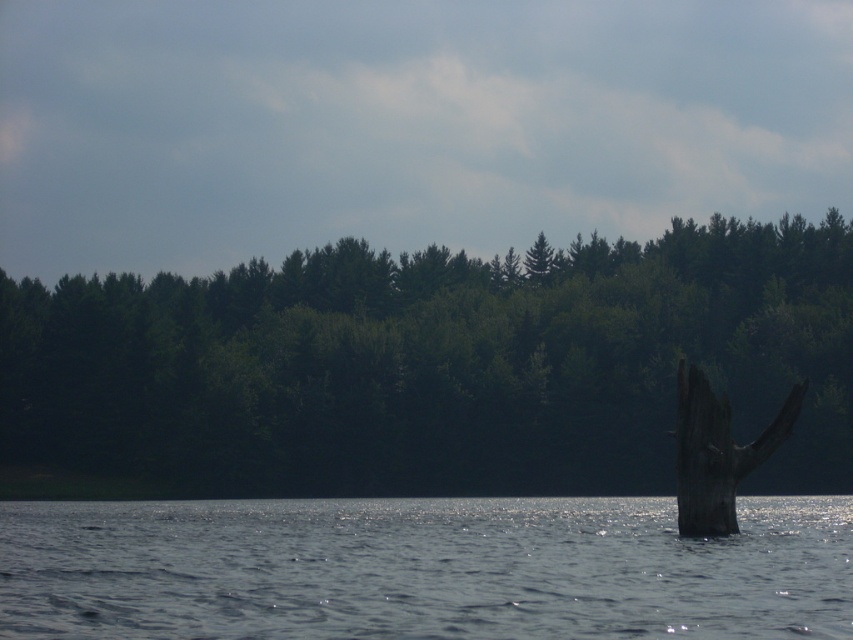
Which of these two, green matte forest at center or clear blue water at center, stands shorter?

clear blue water at center is shorter.

Locate an element on the screen. green matte forest at center is located at coordinates (432, 368).

What do you see at coordinates (432, 368) in the screenshot? This screenshot has width=853, height=640. I see `green matte forest at center` at bounding box center [432, 368].

Locate an element on the screen. The width and height of the screenshot is (853, 640). green matte forest at center is located at coordinates (432, 368).

From the picture: Who is lower down, green matte forest at center or dark brown wood at right?

dark brown wood at right

Which is behind, point (323, 486) or point (701, 449)?

Point (323, 486)

Locate an element on the screen. This screenshot has height=640, width=853. green matte forest at center is located at coordinates (432, 368).

Which is behind, point (798, 540) or point (732, 474)?

Positioned behind is point (798, 540).

Can you confirm if clear blue water at center is positioned above dark brown wood at right?

No, clear blue water at center is not above dark brown wood at right.

What do you see at coordinates (422, 568) in the screenshot? I see `clear blue water at center` at bounding box center [422, 568].

Identify the location of clear blue water at center. (422, 568).